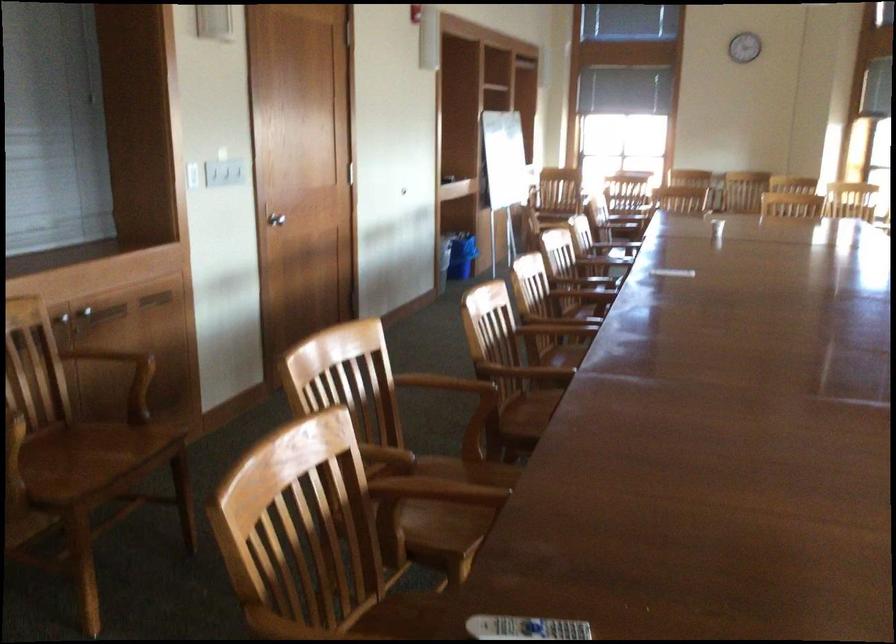
Locate an element on the screen. The width and height of the screenshot is (896, 644). silver door handle is located at coordinates (271, 223).